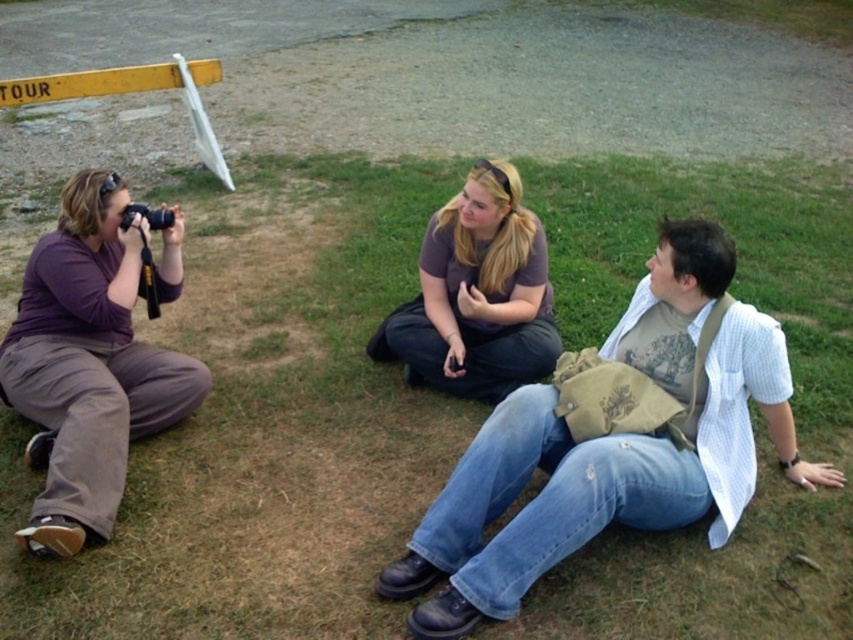
Between blue jeans at center and matte purple shirt at left, which one appears on the left side from the viewer's perspective?

From the viewer's perspective, matte purple shirt at left appears more on the left side.

Which of these two, blue jeans at center or matte purple shirt at left, stands taller?

matte purple shirt at left

Find the location of a particular element. The height and width of the screenshot is (640, 853). blue jeans at center is located at coordinates (611, 449).

Between matte purple shirt at left and yellow painted metal at upper left, which one appears on the left side from the viewer's perspective?

yellow painted metal at upper left

Does point (84, 364) come in front of point (131, 88)?

Yes, it is in front of point (131, 88).

The height and width of the screenshot is (640, 853). What are the coordinates of `matte purple shirt at left` in the screenshot? It's located at (88, 365).

The width and height of the screenshot is (853, 640). Describe the element at coordinates (611, 449) in the screenshot. I see `blue jeans at center` at that location.

Does blue jeans at center have a lesser height compared to yellow painted metal at upper left?

No.

Identify the location of blue jeans at center. The width and height of the screenshot is (853, 640). (611, 449).

Find the location of `blue jeans at center`. blue jeans at center is located at coordinates (611, 449).